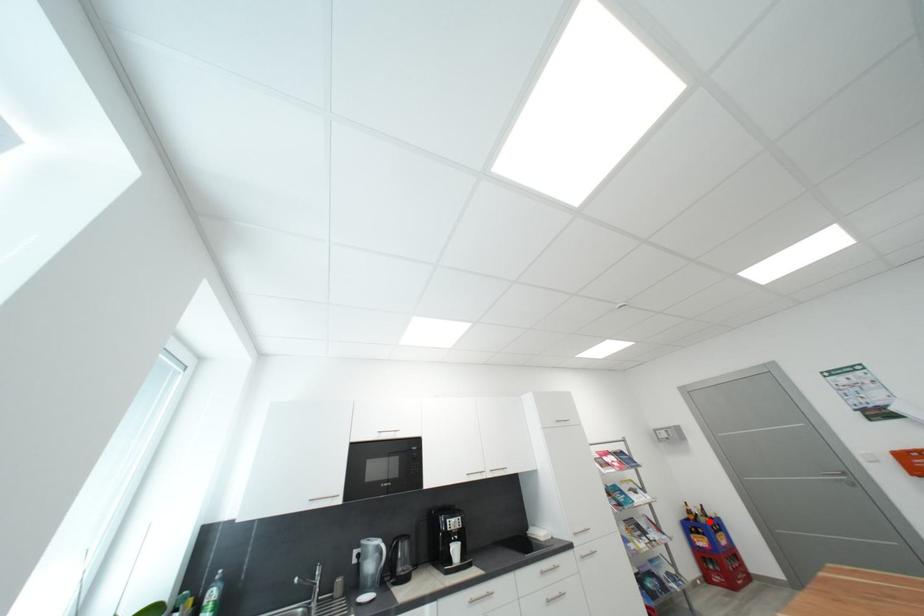
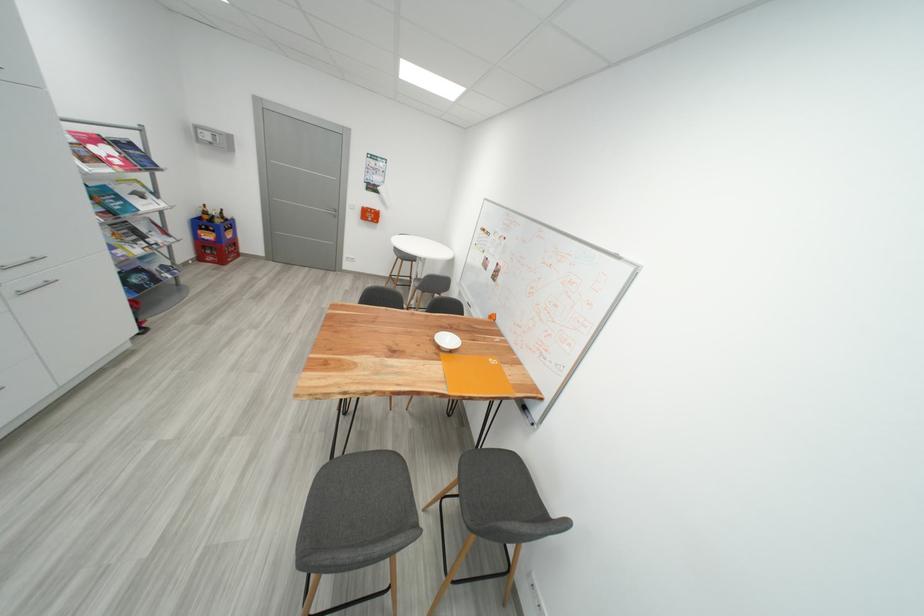
Question: I am providing you with two images of the same scene from different viewpoints. A red point is shown in image1. For the corresponding object point in image2, is it positioned nearer or farther from the camera?

Choices:
 (A) Nearer
 (B) Farther

Answer: (A)